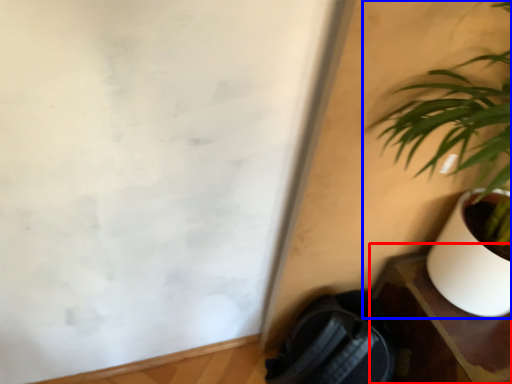
Question: Which object is closer to the camera taking this photo, table (highlighted by a red box) or houseplant (highlighted by a blue box)?

Choices:
 (A) table
 (B) houseplant

Answer: (B)